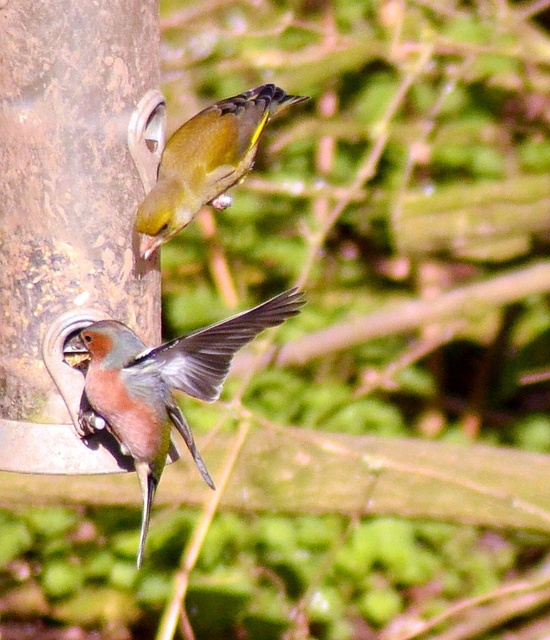
Can you confirm if brown textured pole at left is positioned below green glossy bird at upper center?

Yes, brown textured pole at left is below green glossy bird at upper center.

What are the coordinates of `brown textured pole at left` in the screenshot? It's located at (69, 209).

Who is more distant from viewer, [145,68] or [118,436]?

The point [145,68] is more distant.

Who is more forward, (48, 224) or (177, 412)?

Point (177, 412) is more forward.

At what (x,y) coordinates should I click in order to perform the action: click on brown textured pole at left. Please return your answer as a coordinate pair (x, y). Looking at the image, I should click on (69, 209).

You are a GUI agent. You are given a task and a screenshot of the screen. Output one action in this format:
    pyautogui.click(x=<x>, y=<y>)
    Task: Click on the brown speckled bird at lower left
    The height and width of the screenshot is (640, 550).
    Given the screenshot: What is the action you would take?
    pyautogui.click(x=162, y=385)

Is point (113, 413) farther from camera compared to point (239, 116)?

No, it is in front of (239, 116).

Where is `brown speckled bird at lower left`? The height and width of the screenshot is (640, 550). brown speckled bird at lower left is located at coordinates (162, 385).